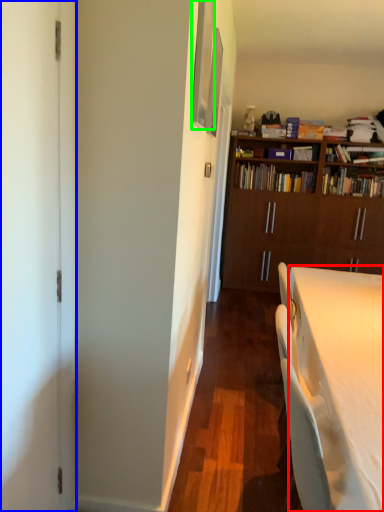
Question: Which object is positioned closest to desk (highlighted by a red box)? Select from screen door (highlighted by a blue box) and picture frame (highlighted by a green box).

Choices:
 (A) screen door
 (B) picture frame

Answer: (A)